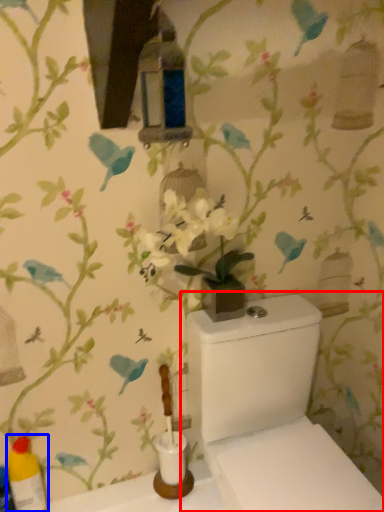
Question: Which point is closer to the camera, toilet (highlighted by a red box) or bottle (highlighted by a blue box)?

Choices:
 (A) toilet
 (B) bottle

Answer: (A)